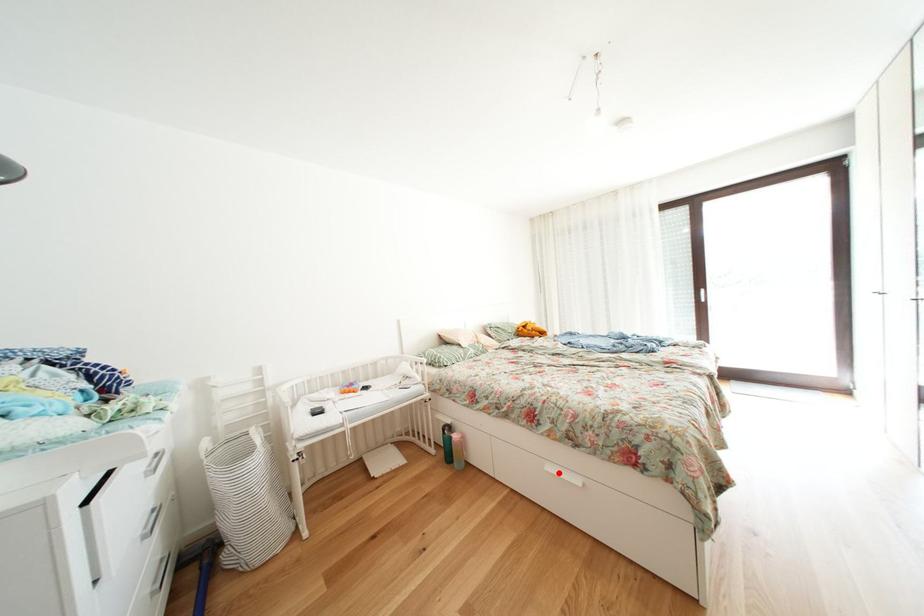
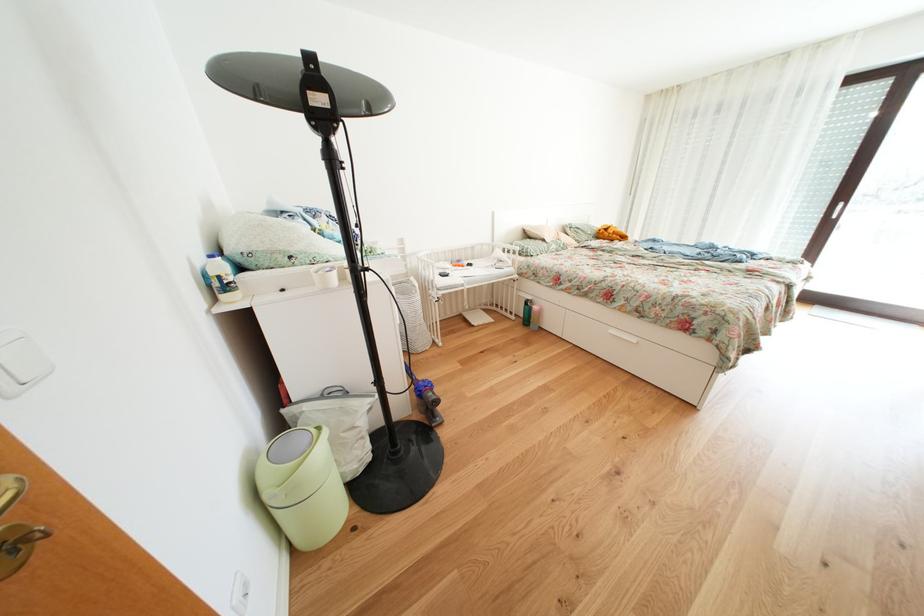
Question: I am providing you with two images of the same scene from different viewpoints. In image1, a red point is highlighted. Considering the same 3D point in image2, which of the following is correct?

Choices:
 (A) It is closer
 (B) It is farther

Answer: (A)